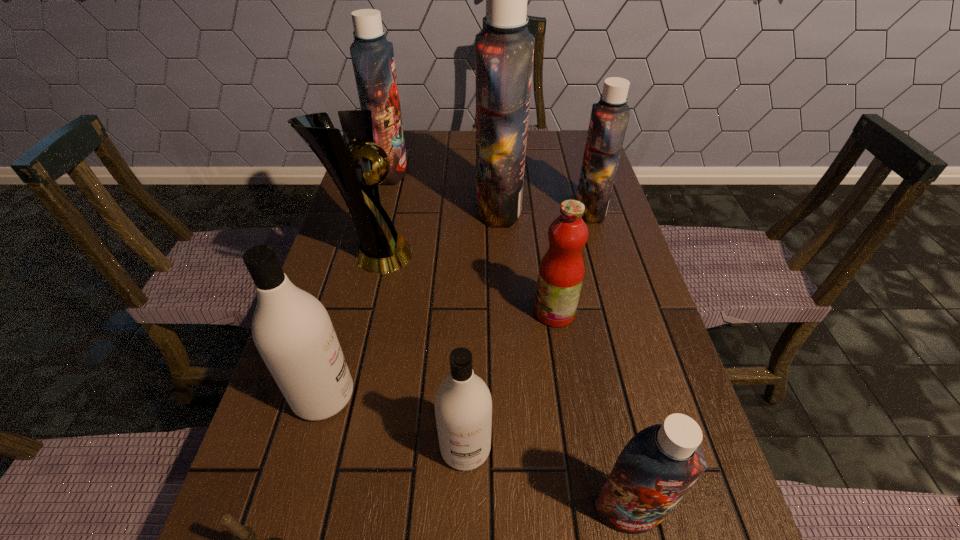
Find the location of a particular element. The image size is (960, 540). the smallest blue shampoo is located at coordinates (656, 468).

In order to click on the smaller white shampoo in this screenshot , I will do `click(463, 405)`.

Identify the location of vacant space situated 0.090m on the front label of the tallest shampoo. This screenshot has width=960, height=540. (444, 207).

Where is `free space located on the front label of the tallest shampoo`? The image size is (960, 540). free space located on the front label of the tallest shampoo is located at coordinates (x=455, y=207).

This screenshot has width=960, height=540. I want to click on vacant space located on the front label of the tallest shampoo, so click(x=350, y=207).

Where is `vacant area situated on the front label of the third smallest blue shampoo`? This screenshot has height=540, width=960. vacant area situated on the front label of the third smallest blue shampoo is located at coordinates (535, 171).

Identify the location of blank area located at the front of the black award, where the globe is visible. The width and height of the screenshot is (960, 540). (523, 255).

Where is `vacant region located 0.220m on the front label of the second smallest blue shampoo`? The width and height of the screenshot is (960, 540). vacant region located 0.220m on the front label of the second smallest blue shampoo is located at coordinates point(497,210).

Locate an element on the screen. This screenshot has width=960, height=540. vacant space located 0.150m on the front label of the second smallest blue shampoo is located at coordinates (522, 210).

The image size is (960, 540). Identify the location of vacant space positioned on the front label of the second smallest blue shampoo. (444, 210).